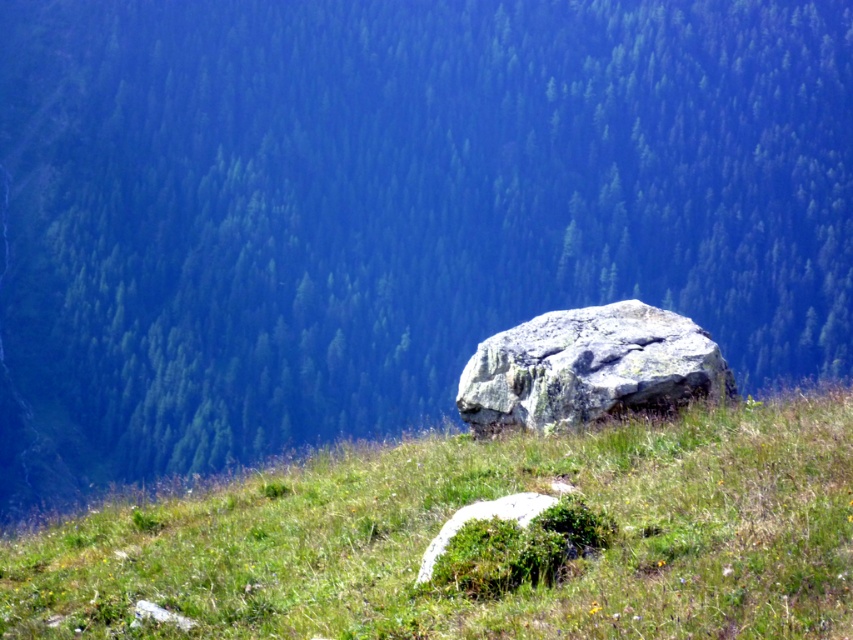
You are standing at the center of the grassy area and want to find the gray rough rock at center. According to the coordinates provided, in which direction should you move to locate it?

The gray rough rock at center is located at coordinates point (589, 368). Since you are at the center, which is typically considered as point (426, 320), you should move northeast to reach it because the rock has higher x and y values than your current position.

You are a hiker who wants to place a small backpack between the gray rough rock at center and the green mossy rock at center. Based on their widths, can you determine if there will be enough space for the backpack?

The gray rough rock at center might be wider than the green mossy rock at center, so there may not be enough space between them for the backpack unless the backpack is very small.